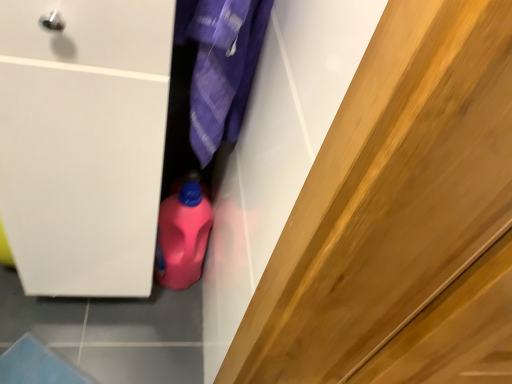
What is the approximate height of pink plastic bottle at center?

14.75 inches.

Where is `pink plastic bottle at center`? This screenshot has height=384, width=512. pink plastic bottle at center is located at coordinates (182, 236).

The width and height of the screenshot is (512, 384). Describe the element at coordinates (182, 236) in the screenshot. I see `pink plastic bottle at center` at that location.

What do you see at coordinates (220, 65) in the screenshot? Image resolution: width=512 pixels, height=384 pixels. I see `purple fabric at center` at bounding box center [220, 65].

Where is `purple fabric at center`? This screenshot has height=384, width=512. purple fabric at center is located at coordinates (220, 65).

The width and height of the screenshot is (512, 384). In order to click on pink plastic bottle at center in this screenshot , I will do `click(182, 236)`.

Is pink plastic bottle at center at the left side of purple fabric at center?

Yes.

Is pink plastic bottle at center in front of or behind purple fabric at center in the image?

Clearly, pink plastic bottle at center is behind purple fabric at center.

Which point is more forward, (x=185, y=272) or (x=237, y=36)?

The point (x=237, y=36) is more forward.

From the image's perspective, is pink plastic bottle at center above or below purple fabric at center?

Based on their image positions, pink plastic bottle at center is located beneath purple fabric at center.

Based on the photo, from a real-world perspective, who is located higher, pink plastic bottle at center or purple fabric at center?

purple fabric at center is physically above.

Which object is thinner, pink plastic bottle at center or purple fabric at center?

With smaller width is pink plastic bottle at center.

Consider the image. Is pink plastic bottle at center taller or shorter than purple fabric at center?

Clearly, pink plastic bottle at center is shorter compared to purple fabric at center.

Can you confirm if pink plastic bottle at center is smaller than purple fabric at center?

Indeed, pink plastic bottle at center has a smaller size compared to purple fabric at center.

Choose the correct answer: Is pink plastic bottle at center inside purple fabric at center or outside it?

pink plastic bottle at center is located beyond the bounds of purple fabric at center.

Is pink plastic bottle at center far away from purple fabric at center?

Actually, pink plastic bottle at center and purple fabric at center are a little close together.

Is pink plastic bottle at center positioned with its back to purple fabric at center?

That's not correct — pink plastic bottle at center is not looking away from purple fabric at center.

What's the angular difference between pink plastic bottle at center and purple fabric at center's facing directions?

There is a 90-degree angle between the facing directions of pink plastic bottle at center and purple fabric at center.

The width and height of the screenshot is (512, 384). I want to click on clothing above the pink plastic bottle at center (from a real-world perspective), so click(220, 65).

Does purple fabric at center appear on the right side of pink plastic bottle at center?

Indeed, purple fabric at center is positioned on the right side of pink plastic bottle at center.

Considering their positions, is purple fabric at center located in front of or behind pink plastic bottle at center?

purple fabric at center is positioned closer to the viewer than pink plastic bottle at center.

Is point (237, 13) closer or farther from the camera than point (212, 216)?

Point (237, 13) is closer to the camera than point (212, 216).

From the image's perspective, is purple fabric at center above pink plastic bottle at center?

Yes.

From a real-world perspective, which object stands above the other?

In real-world perspective, purple fabric at center is above.

Between purple fabric at center and pink plastic bottle at center, which one has larger width?

purple fabric at center.

In the scene shown: Can you confirm if purple fabric at center is shorter than pink plastic bottle at center?

No.

In terms of size, does purple fabric at center appear bigger or smaller than pink plastic bottle at center?

In the image, purple fabric at center appears to be larger than pink plastic bottle at center.

Does purple fabric at center contain pink plastic bottle at center?

No, pink plastic bottle at center is not surrounded by purple fabric at center.

In the scene shown: Are purple fabric at center and pink plastic bottle at center far apart?

No.

Could you tell me if purple fabric at center is turned towards pink plastic bottle at center?

No, purple fabric at center is not facing towards pink plastic bottle at center.

The width and height of the screenshot is (512, 384). I want to click on cleaning product on the left of purple fabric at center, so click(182, 236).

Find the location of a particular element. The image size is (512, 384). clothing above the pink plastic bottle at center (from the image's perspective) is located at coordinates (220, 65).

Locate an element on the screen. clothing above the pink plastic bottle at center (from a real-world perspective) is located at coordinates (220, 65).